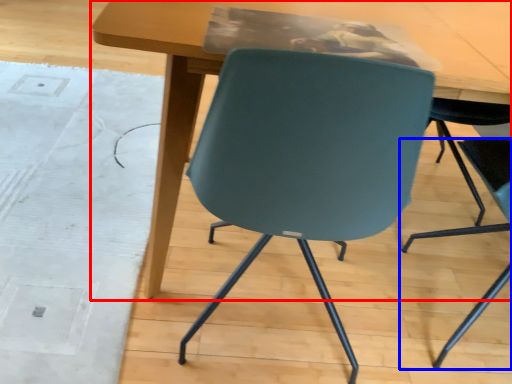
Question: Which object appears closest to the camera in this image, table (highlighted by a red box) or chair (highlighted by a blue box)?

Choices:
 (A) table
 (B) chair

Answer: (B)